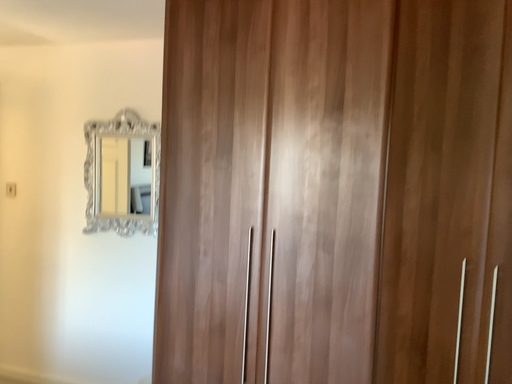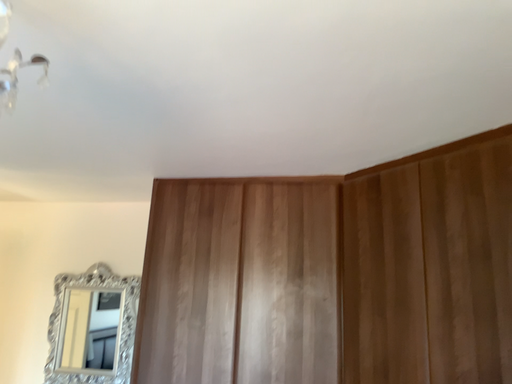
Question: Which way did the camera rotate in the video?

Choices:
 (A) rotated left
 (B) rotated right

Answer: (B)